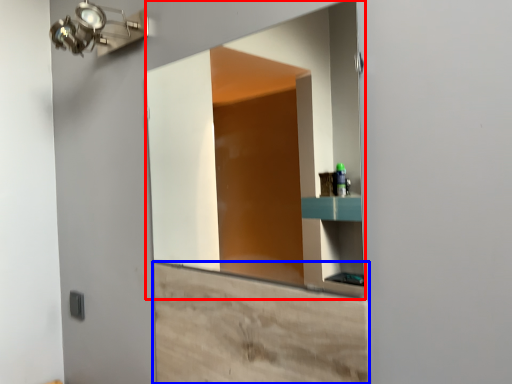
Question: Which point is further to the camera, mirror (highlighted by a red box) or cabinetry (highlighted by a blue box)?

Choices:
 (A) mirror
 (B) cabinetry

Answer: (A)